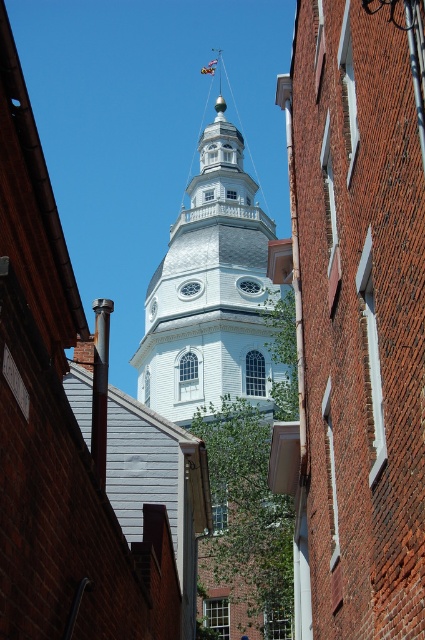
You are standing in front of the tower and want to take a photo that includes both the brick church at center and the white textured dome at center. Which one should you focus on first to ensure both are in frame?

The brick church at center has a lesser height compared to the white textured dome at center, so you should focus on the white textured dome at center first to ensure both are in frame.

You are standing in front of the tower and notice two points marked on the tower. The first point is at coordinate point [333,76] and the second is at point [212,68]. Which point is closer to you?

Point [333,76] is closer to the viewer than point [212,68].